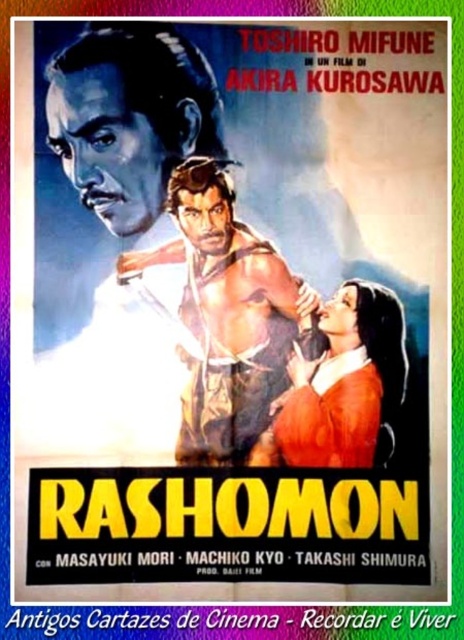
How far apart are muscular skin warrior at center and smooth orange dress at center?

4.02 inches

Between muscular skin warrior at center and smooth orange dress at center, which one has less height?

Standing shorter between the two is smooth orange dress at center.

Which is behind, point (229, 451) or point (387, 336)?

The point (387, 336) is more distant.

Where is `muscular skin warrior at center`? The width and height of the screenshot is (464, 640). muscular skin warrior at center is located at coordinates (227, 316).